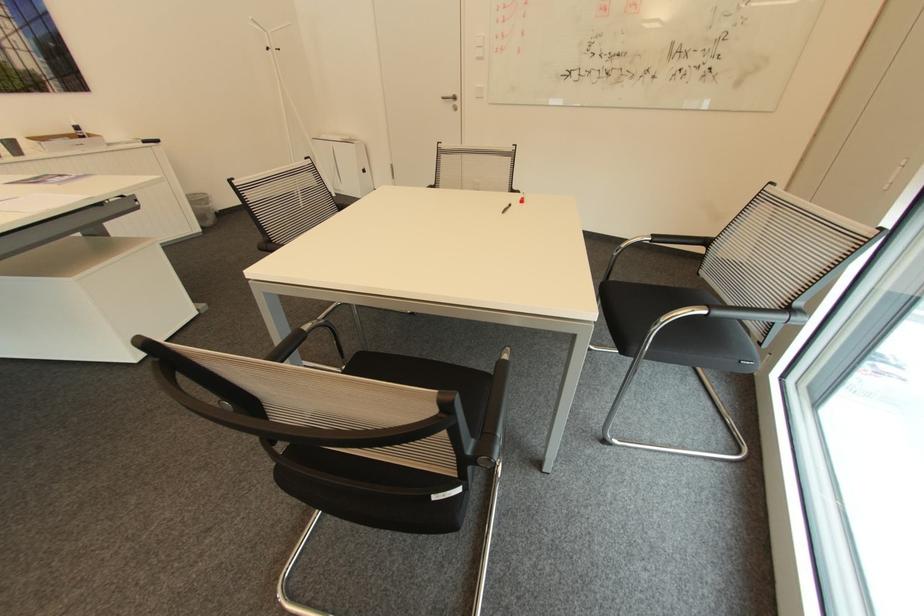
This screenshot has width=924, height=616. Describe the element at coordinates (479, 46) in the screenshot. I see `a white light switch` at that location.